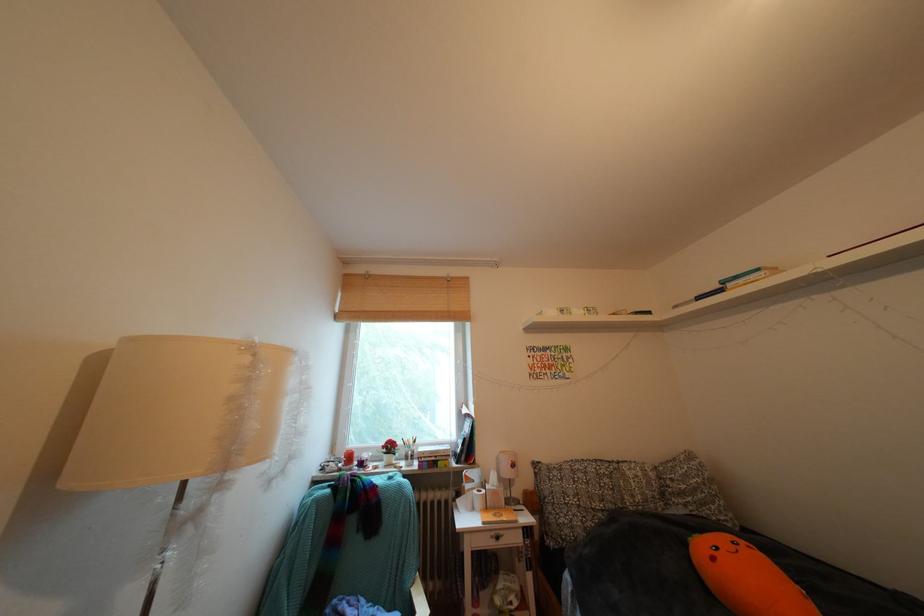
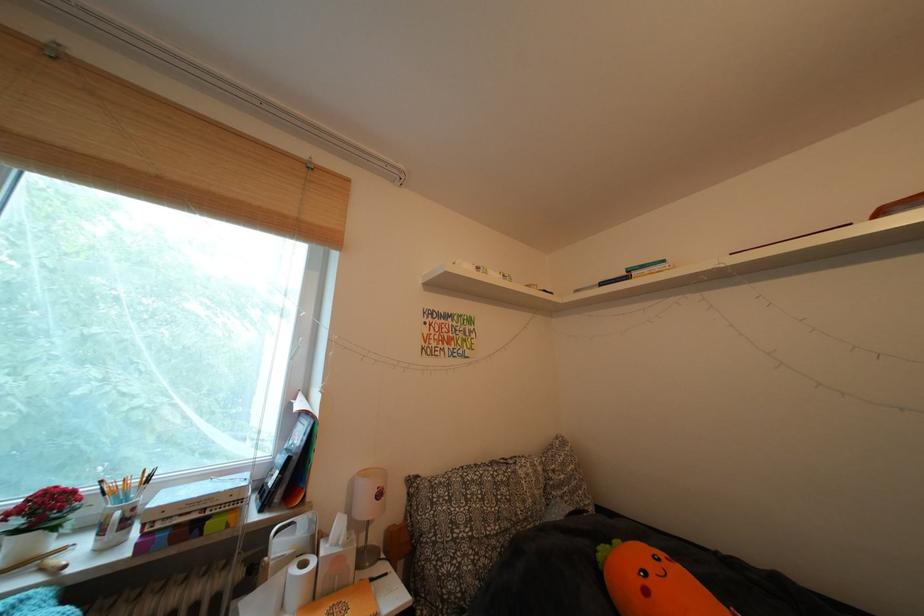
Where in the second image is the point corresponding to (x=431, y=455) from the first image?

(172, 504)